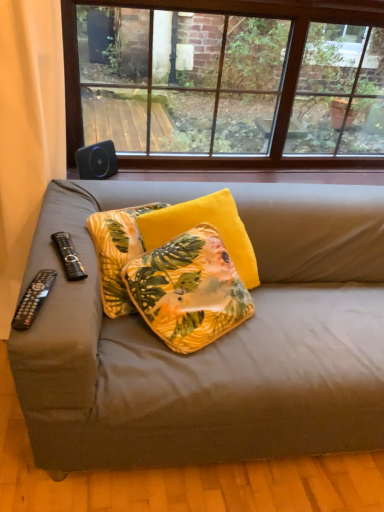
This screenshot has height=512, width=384. I want to click on black fabric remote at left, so click(27, 131).

Describe the element at coordinates (68, 256) in the screenshot. I see `black plastic remote at left, which ranks as the second remote control in front-to-back order` at that location.

What is the approximate height of black plastic remote at lower left, which is counted as the 2th remote control, starting from the top?

The height of black plastic remote at lower left, which is counted as the 2th remote control, starting from the top, is 1.48 inches.

The image size is (384, 512). I want to click on brown wooden window at upper center, so click(226, 80).

Considering the sizes of objects black plastic remote at lower left, which is counted as the 2th remote control, starting from the top, and black fabric remote at left in the image provided, who is bigger, black plastic remote at lower left, which is counted as the 2th remote control, starting from the top, or black fabric remote at left?

black fabric remote at left is bigger.

Which of these two, black plastic remote at lower left, marked as the second remote control in a back-to-front arrangement, or black fabric remote at left, is wider?

black fabric remote at left is wider.

Does black plastic remote at lower left, marked as the second remote control in a back-to-front arrangement, turn towards black fabric remote at left?

No, black plastic remote at lower left, marked as the second remote control in a back-to-front arrangement, is not facing towards black fabric remote at left.

How different are the orientations of black plastic remote at lower left, the 1th remote control when ordered from bottom to top, and black fabric remote at left in degrees?

There is a 11.7-degree angle between the facing directions of black plastic remote at lower left, the 1th remote control when ordered from bottom to top, and black fabric remote at left.

Does black plastic remote at lower left, the 1th remote control when ordered from bottom to top, turn towards yellow velvet pillow at center, the 3th pillow viewed from the left?

No, black plastic remote at lower left, the 1th remote control when ordered from bottom to top, is not aimed at yellow velvet pillow at center, the 3th pillow viewed from the left.

Is black plastic remote at lower left, marked as the first remote control in a front-to-back arrangement, positioned beyond the bounds of yellow velvet pillow at center, the 1th pillow when ordered from right to left?

Indeed, black plastic remote at lower left, marked as the first remote control in a front-to-back arrangement, is completely outside yellow velvet pillow at center, the 1th pillow when ordered from right to left.

Can you confirm if black plastic remote at lower left, the 1th remote control when ordered from bottom to top, is positioned to the right of yellow velvet pillow at center, the 1th pillow when ordered from right to left?

Incorrect, black plastic remote at lower left, the 1th remote control when ordered from bottom to top, is not on the right side of yellow velvet pillow at center, the 1th pillow when ordered from right to left.

Can you confirm if black plastic remote at lower left, which is counted as the 2th remote control, starting from the top, is wider than yellow velvet pillow at center, the 3th pillow viewed from the left?

Incorrect, the width of black plastic remote at lower left, which is counted as the 2th remote control, starting from the top, does not surpass that of yellow velvet pillow at center, the 3th pillow viewed from the left.

Between black fabric remote at left and yellow velvet pillow at center, positioned as the 1th pillow in left-to-right order, which one has larger size?

Bigger between the two is black fabric remote at left.

Would you say black fabric remote at left is a long distance from yellow velvet pillow at center, the third pillow from the right?

No.

You are a GUI agent. You are given a task and a screenshot of the screen. Output one action in this format:
    pyautogui.click(x=<x>, y=<y>)
    Task: Click on the 2nd pillow below when counting from the black fabric remote at left (from the image's perspective)
    The height and width of the screenshot is (512, 384).
    Given the screenshot: What is the action you would take?
    pyautogui.click(x=117, y=252)

How much distance is there between black fabric remote at left and yellow velvet pillow at center, the third pillow from the right?

A distance of 19.65 inches exists between black fabric remote at left and yellow velvet pillow at center, the third pillow from the right.

From the image's perspective, would you say matte gray couch at center is positioned over black plastic remote at lower left, which is counted as the 2th remote control, starting from the top?

Incorrect, from the image's perspective, matte gray couch at center is lower than black plastic remote at lower left, which is counted as the 2th remote control, starting from the top.

Considering the relative positions of matte gray couch at center and black plastic remote at lower left, marked as the first remote control in a front-to-back arrangement, in the image provided, is matte gray couch at center to the right of black plastic remote at lower left, marked as the first remote control in a front-to-back arrangement, from the viewer's perspective?

Indeed, matte gray couch at center is positioned on the right side of black plastic remote at lower left, marked as the first remote control in a front-to-back arrangement.

Considering the sizes of matte gray couch at center and black plastic remote at lower left, marked as the second remote control in a back-to-front arrangement, in the image, is matte gray couch at center wider or thinner than black plastic remote at lower left, marked as the second remote control in a back-to-front arrangement,?

Clearly, matte gray couch at center has more width compared to black plastic remote at lower left, marked as the second remote control in a back-to-front arrangement.

Would you say black plastic remote at lower left, marked as the first remote control in a front-to-back arrangement, is part of matte gray couch at center's contents?

Yes, matte gray couch at center contains black plastic remote at lower left, marked as the first remote control in a front-to-back arrangement.

From a real-world perspective, is brown wooden window at upper center below black plastic remote at left, which ranks as the second remote control in front-to-back order?

No, from a real-world perspective, brown wooden window at upper center is not under black plastic remote at left, which ranks as the second remote control in front-to-back order.

Is brown wooden window at upper center positioned beyond the bounds of black plastic remote at left, the 1th remote control from the top?

Yes, brown wooden window at upper center is located beyond the bounds of black plastic remote at left, the 1th remote control from the top.

Is the surface of brown wooden window at upper center in direct contact with black plastic remote at left, which ranks as the second remote control in front-to-back order?

brown wooden window at upper center and black plastic remote at left, which ranks as the second remote control in front-to-back order, are not in contact.

From the image's perspective, which is above, black plastic remote at left, which ranks as the second remote control in front-to-back order, or matte gray couch at center?

From the image's view, black plastic remote at left, which ranks as the second remote control in front-to-back order, is above.

How many degrees apart are the facing directions of black plastic remote at left, the 1th remote control from the top, and matte gray couch at center?

black plastic remote at left, the 1th remote control from the top, and matte gray couch at center are facing 16.3 degrees away from each other.

From a real-world perspective, who is located lower, black plastic remote at left, which ranks as the second remote control in front-to-back order, or matte gray couch at center?

matte gray couch at center.

In terms of width, does brown wooden window at upper center look wider or thinner when compared to matte gray couch at center?

Clearly, brown wooden window at upper center has less width compared to matte gray couch at center.

Image resolution: width=384 pixels, height=512 pixels. In order to click on window lying on the left of matte gray couch at center in this screenshot , I will do `click(226, 80)`.

Based on the photo, is brown wooden window at upper center in contact with matte gray couch at center?

No, brown wooden window at upper center is not with matte gray couch at center.

Consider the image. Relative to matte gray couch at center, is brown wooden window at upper center in front or behind?

In the image, brown wooden window at upper center appears behind matte gray couch at center.

Find the location of a particular element. Image resolution: width=384 pixels, height=512 pixels. curtain above the black plastic remote at lower left, the 1th remote control when ordered from bottom to top (from the image's perspective) is located at coordinates (27, 131).

Where is `the 2nd remote control to the left of the yellow velvet pillow at center, the 3th pillow viewed from the left, starting your count from the anchor`? The width and height of the screenshot is (384, 512). the 2nd remote control to the left of the yellow velvet pillow at center, the 3th pillow viewed from the left, starting your count from the anchor is located at coordinates (33, 298).

Based on the photo, which object lies nearer to the anchor point yellow velvet pillow at center, the 3th pillow viewed from the left, black plastic remote at left, which is the first remote control in back-to-front order, or brown wooden window at upper center?

black plastic remote at left, which is the first remote control in back-to-front order, is closer to yellow velvet pillow at center, the 3th pillow viewed from the left.

Based on their spatial positions, is matte gray couch at center or black plastic remote at lower left, which is counted as the 2th remote control, starting from the top, closer to yellow velvet pillow at center, the third pillow from the right?

black plastic remote at lower left, which is counted as the 2th remote control, starting from the top, is positioned closer to the anchor yellow velvet pillow at center, the third pillow from the right.

When comparing their distances from brown wooden window at upper center, does black plastic remote at lower left, marked as the first remote control in a front-to-back arrangement, or yellow floral pillow at center, the 2th pillow in the left-to-right sequence, seem closer?

yellow floral pillow at center, the 2th pillow in the left-to-right sequence, is positioned closer to the anchor brown wooden window at upper center.

Looking at the image, which one is located further to yellow velvet pillow at center, the 3th pillow viewed from the left, black plastic remote at lower left, marked as the first remote control in a front-to-back arrangement, or brown wooden window at upper center?

The object further to yellow velvet pillow at center, the 3th pillow viewed from the left, is brown wooden window at upper center.

Estimate the real-world distances between objects in this image. Which object is further from yellow velvet pillow at center, the third pillow from the right, yellow floral pillow at center, positioned as the 2th pillow in right-to-left order, or matte gray couch at center?

matte gray couch at center is further to yellow velvet pillow at center, the third pillow from the right.

When comparing their distances from yellow floral pillow at center, the 2th pillow in the left-to-right sequence, does matte gray couch at center or black plastic remote at lower left, which is counted as the 2th remote control, starting from the top, seem closer?

Among the two, matte gray couch at center is located nearer to yellow floral pillow at center, the 2th pillow in the left-to-right sequence.

Considering their positions, is yellow floral pillow at center, the 2th pillow in the left-to-right sequence, positioned further to yellow velvet pillow at center, positioned as the 1th pillow in left-to-right order, than black fabric remote at left?

The object further to yellow velvet pillow at center, positioned as the 1th pillow in left-to-right order, is black fabric remote at left.

From the picture: Estimate the real-world distances between objects in this image. Which object is closer to yellow floral pillow at center, positioned as the 2th pillow in right-to-left order, black plastic remote at left, the 1th remote control from the top, or black plastic remote at lower left, which is counted as the 2th remote control, starting from the top?

The object closer to yellow floral pillow at center, positioned as the 2th pillow in right-to-left order, is black plastic remote at left, the 1th remote control from the top.

Where is `remote control positioned between black plastic remote at lower left, the 1th remote control when ordered from bottom to top, and yellow velvet pillow at center, positioned as the 1th pillow in left-to-right order, from near to far`? remote control positioned between black plastic remote at lower left, the 1th remote control when ordered from bottom to top, and yellow velvet pillow at center, positioned as the 1th pillow in left-to-right order, from near to far is located at coordinates [68, 256].

Identify the location of remote control between black plastic remote at lower left, the 1th remote control when ordered from bottom to top, and matte gray couch at center, in the horizontal direction. The height and width of the screenshot is (512, 384). (68, 256).

Where is `remote control between black fabric remote at left and black plastic remote at lower left, marked as the first remote control in a front-to-back arrangement, in the vertical direction`? Image resolution: width=384 pixels, height=512 pixels. remote control between black fabric remote at left and black plastic remote at lower left, marked as the first remote control in a front-to-back arrangement, in the vertical direction is located at coordinates pos(68,256).

Where is `remote control that lies between brown wooden window at upper center and black plastic remote at lower left, marked as the second remote control in a back-to-front arrangement, from top to bottom`? The height and width of the screenshot is (512, 384). remote control that lies between brown wooden window at upper center and black plastic remote at lower left, marked as the second remote control in a back-to-front arrangement, from top to bottom is located at coordinates (68, 256).